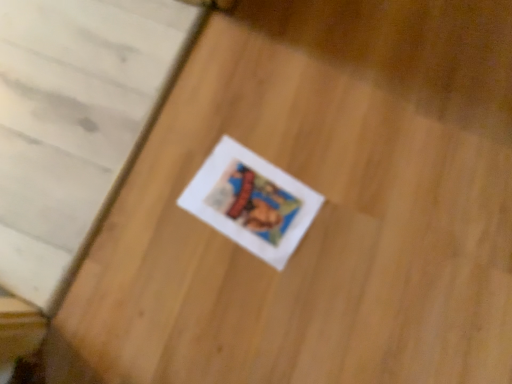
Describe the element at coordinates (74, 123) in the screenshot. This screenshot has height=384, width=512. I see `white wood stairs at upper left` at that location.

In order to face white wood stairs at upper left, should I rotate leftwards or rightwards?

A 26.746 degree turn to the left will do.

Locate an element on the screen. Image resolution: width=512 pixels, height=384 pixels. white wood stairs at upper left is located at coordinates (74, 123).

What is the approximate height of white wood stairs at upper left?

1.61 inches.

At what (x,y) coordinates should I click in order to perform the action: click on white wood stairs at upper left. Please return your answer as a coordinate pair (x, y). This screenshot has height=384, width=512. Looking at the image, I should click on (74, 123).